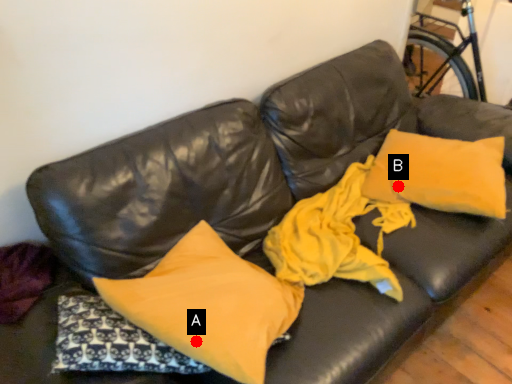
Question: Two points are circled on the image, labeled by A and B beside each circle. Among these points, which one is farthest from the camera?

Choices:
 (A) A is further
 (B) B is further

Answer: (B)